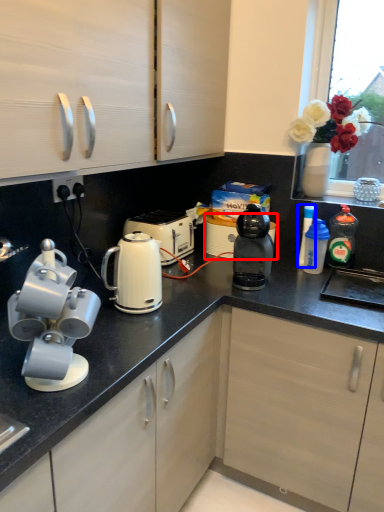
Question: Which point is further to the camera, appliance (highlighted by a red box) or kitchen appliance (highlighted by a blue box)?

Choices:
 (A) appliance
 (B) kitchen appliance

Answer: (A)